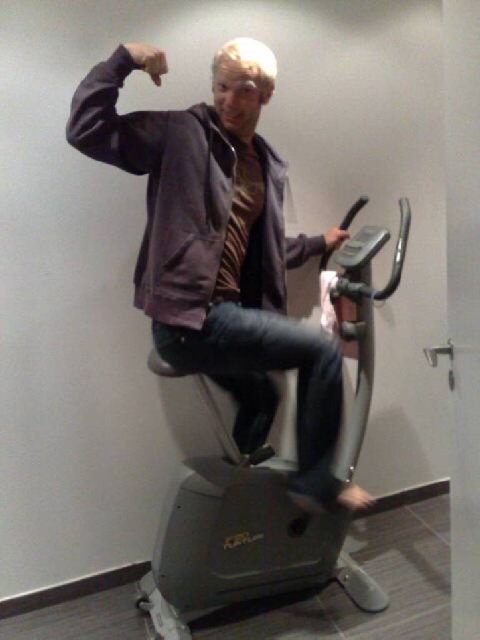
Question: Is matte purple jacket at center to the right of metallic gray exercise bike at center from the viewer's perspective?

Choices:
 (A) yes
 (B) no

Answer: (B)

Question: Does matte purple jacket at center lie in front of metallic gray exercise bike at center?

Choices:
 (A) yes
 (B) no

Answer: (A)

Question: Which point appears farthest from the camera in this image?

Choices:
 (A) pos(264,426)
 (B) pos(327,301)

Answer: (A)

Question: Which point is closer to the camera?

Choices:
 (A) (367, 609)
 (B) (251, 349)

Answer: (B)

Question: Does matte purple jacket at center appear on the right side of metallic gray exercise bike at center?

Choices:
 (A) yes
 (B) no

Answer: (B)

Question: Among these objects, which one is nearest to the camera?

Choices:
 (A) matte purple jacket at center
 (B) metallic gray exercise bike at center

Answer: (A)